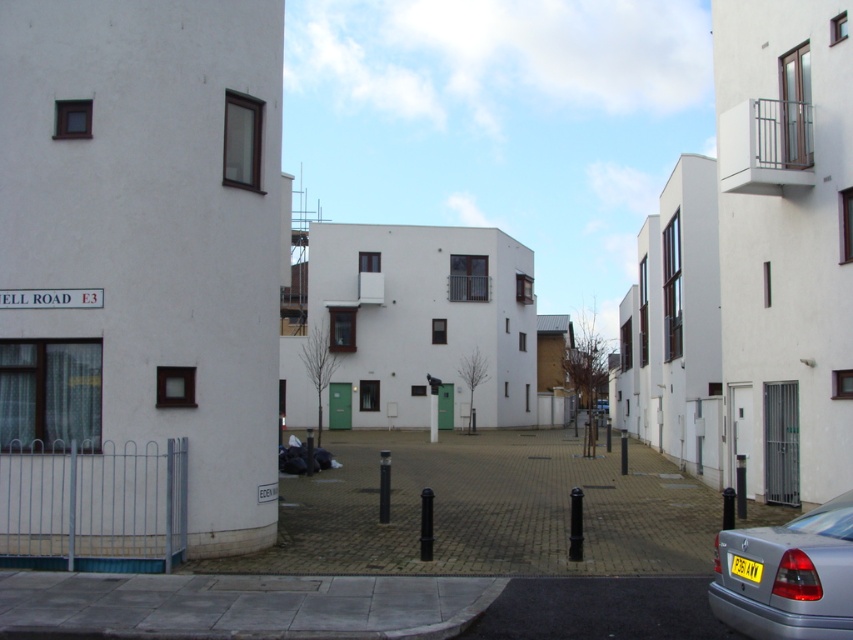
Question: Is silver metallic car at lower right positioned before yellow plastic license plate at lower right?

Choices:
 (A) no
 (B) yes

Answer: (B)

Question: Is silver metallic car at lower right smaller than yellow plastic license plate at lower right?

Choices:
 (A) no
 (B) yes

Answer: (A)

Question: Which point is closer to the camera taking this photo?

Choices:
 (A) pos(810,532)
 (B) pos(755,576)

Answer: (B)

Question: Which point is farther to the camera?

Choices:
 (A) (747, 577)
 (B) (753, 618)

Answer: (A)

Question: Is silver metallic car at lower right above yellow plastic license plate at lower right?

Choices:
 (A) no
 (B) yes

Answer: (B)